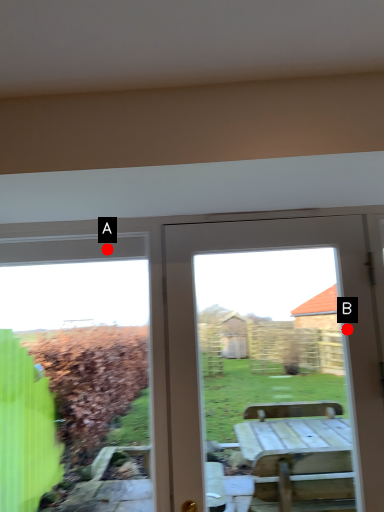
Question: Two points are circled on the image, labeled by A and B beside each circle. Which point appears farthest from the camera in this image?

Choices:
 (A) A is further
 (B) B is further

Answer: (A)